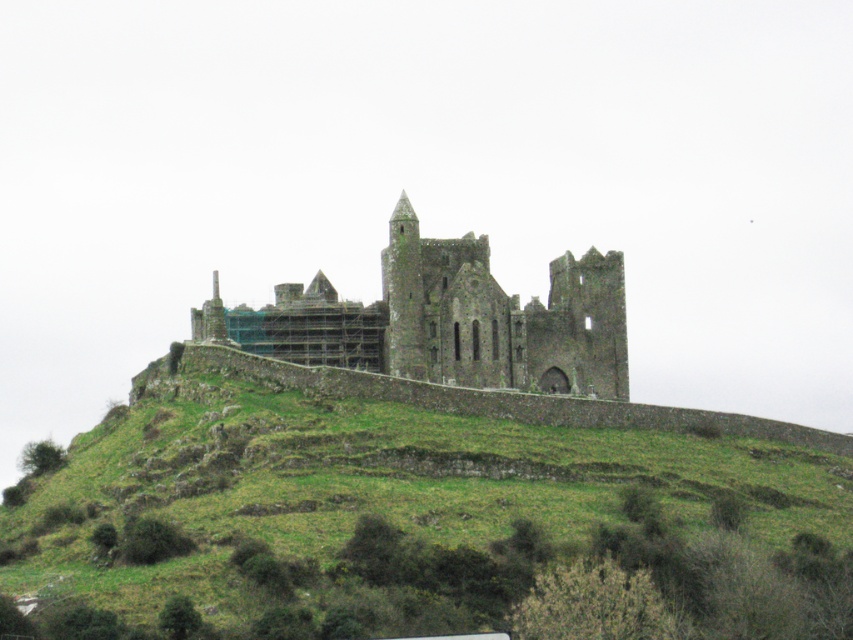
How distant is green grassy hillside at center from rusty stone castle at center?

green grassy hillside at center and rusty stone castle at center are 22.64 meters apart.

Which is behind, point (828, 486) or point (321, 280)?

Positioned behind is point (321, 280).

Locate an element on the screen. This screenshot has height=640, width=853. green grassy hillside at center is located at coordinates (415, 512).